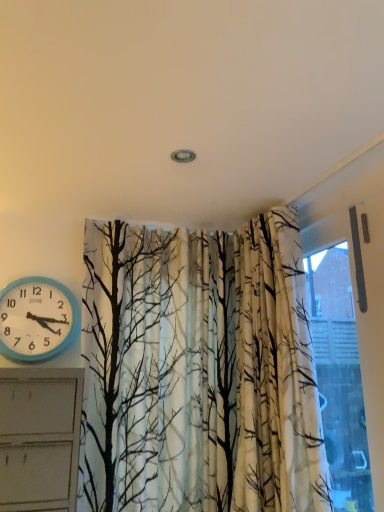
You are a GUI agent. You are given a task and a screenshot of the screen. Output one action in this format:
    pyautogui.click(x=<x>, y=<y>)
    Task: Click on the blue plastic wall clock at left
    The width and height of the screenshot is (384, 512).
    Given the screenshot: What is the action you would take?
    pyautogui.click(x=37, y=319)

Describe the element at coordinates (37, 319) in the screenshot. The image size is (384, 512). I see `blue plastic wall clock at left` at that location.

What do you see at coordinates (345, 353) in the screenshot? The height and width of the screenshot is (512, 384). I see `transparent glass window at upper right` at bounding box center [345, 353].

What is the approximate width of transparent glass window at upper right?

The width of transparent glass window at upper right is 2.99 inches.

You are a GUI agent. You are given a task and a screenshot of the screen. Output one action in this format:
    pyautogui.click(x=<x>, y=<y>)
    Task: Click on the transparent glass window at upper right
    The width and height of the screenshot is (384, 512).
    Given the screenshot: What is the action you would take?
    pyautogui.click(x=345, y=353)

Find the location of `blue plastic wall clock at left`. blue plastic wall clock at left is located at coordinates (37, 319).

Which is more to the right, blue plastic wall clock at left or transparent glass window at upper right?

From the viewer's perspective, transparent glass window at upper right appears more on the right side.

Does blue plastic wall clock at left come in front of transparent glass window at upper right?

No, blue plastic wall clock at left is further to the viewer.

Which point is more forward, (51, 315) or (316, 289)?

The point (51, 315) is closer.

From the image's perspective, is blue plastic wall clock at left on top of transparent glass window at upper right?

Yes, from the image's perspective, blue plastic wall clock at left is over transparent glass window at upper right.

From a real-world perspective, is blue plastic wall clock at left beneath transparent glass window at upper right?

Actually, blue plastic wall clock at left is physically above transparent glass window at upper right in the real world.

Which object is wider, blue plastic wall clock at left or transparent glass window at upper right?

Wider between the two is blue plastic wall clock at left.

From their relative heights in the image, would you say blue plastic wall clock at left is taller or shorter than transparent glass window at upper right?

A: Clearly, blue plastic wall clock at left is shorter compared to transparent glass window at upper right.

Can you confirm if blue plastic wall clock at left is bigger than transparent glass window at upper right?

Incorrect, blue plastic wall clock at left is not larger than transparent glass window at upper right.

Would you say blue plastic wall clock at left is outside transparent glass window at upper right?

Indeed, blue plastic wall clock at left is completely outside transparent glass window at upper right.

Is the surface of blue plastic wall clock at left in direct contact with transparent glass window at upper right?

No, blue plastic wall clock at left is not in contact with transparent glass window at upper right.

Is transparent glass window at upper right at the back of blue plastic wall clock at left?

No, blue plastic wall clock at left's orientation is not away from transparent glass window at upper right.

In the image, there is a transparent glass window at upper right. Where is `wall clock above it (from the image's perspective)`? wall clock above it (from the image's perspective) is located at coordinates (37, 319).

Is transparent glass window at upper right to the left or to the right of blue plastic wall clock at left in the image?

Clearly, transparent glass window at upper right is on the right of blue plastic wall clock at left in the image.

Is transparent glass window at upper right in front of or behind blue plastic wall clock at left in the image?

Visually, transparent glass window at upper right is located in front of blue plastic wall clock at left.

Is point (373, 355) positioned behind point (9, 333)?

No, it is not.

From the image's perspective, is transparent glass window at upper right above or below blue plastic wall clock at left?

From the image's perspective, transparent glass window at upper right appears below blue plastic wall clock at left.

From a real-world perspective, who is located higher, transparent glass window at upper right or blue plastic wall clock at left?

blue plastic wall clock at left is physically above.

Between transparent glass window at upper right and blue plastic wall clock at left, which one has smaller width?

transparent glass window at upper right is thinner.

Considering the sizes of transparent glass window at upper right and blue plastic wall clock at left in the image, is transparent glass window at upper right taller or shorter than blue plastic wall clock at left?

In the image, transparent glass window at upper right appears to be taller than blue plastic wall clock at left.

Which of these two, transparent glass window at upper right or blue plastic wall clock at left, is bigger?

transparent glass window at upper right is bigger.

Is transparent glass window at upper right located outside blue plastic wall clock at left?

transparent glass window at upper right lies outside blue plastic wall clock at left's area.

Is transparent glass window at upper right positioned far away from blue plastic wall clock at left?

Yes, transparent glass window at upper right and blue plastic wall clock at left are located far from each other.

Does transparent glass window at upper right turn towards blue plastic wall clock at left?

No, transparent glass window at upper right is not facing towards blue plastic wall clock at left.

Find the location of a particular element. Image resolution: width=384 pixels, height=512 pixels. wall clock lying above the transparent glass window at upper right (from the image's perspective) is located at coordinates (37, 319).

Locate an element on the screen. Image resolution: width=384 pixels, height=512 pixels. wall clock above the transparent glass window at upper right (from a real-world perspective) is located at coordinates (37, 319).

Find the location of a particular element. window lying below the blue plastic wall clock at left (from the image's perspective) is located at coordinates (345, 353).